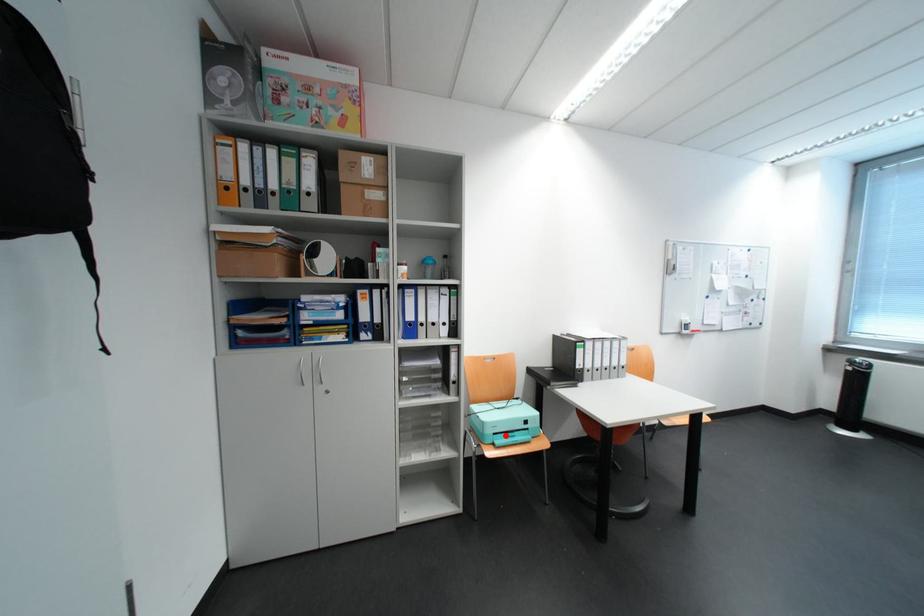
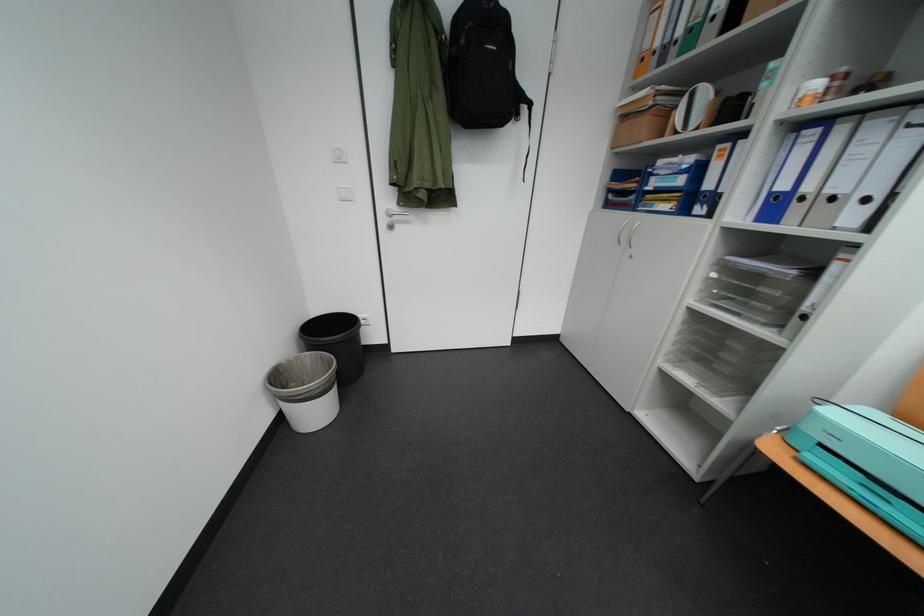
Where in the second image is the point corresponding to the highlighted location from the first image?

(833, 447)